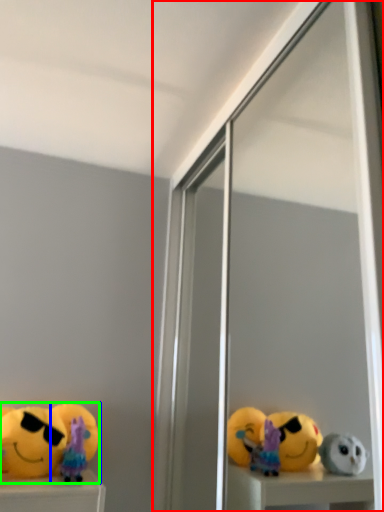
Question: Which is nearer to the screen door (highlighted by a red box)? toy (highlighted by a blue box) or toy (highlighted by a green box).

Choices:
 (A) toy
 (B) toy

Answer: (B)